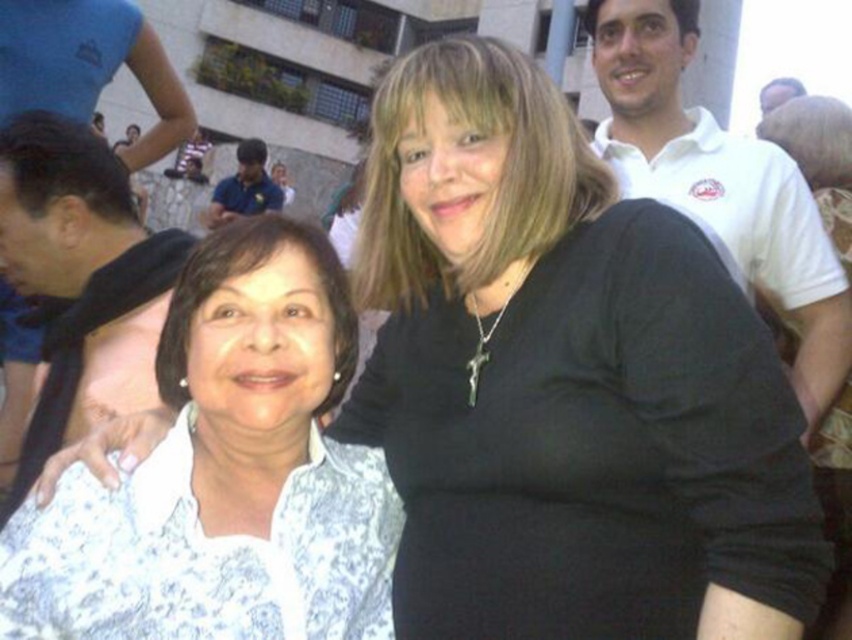
You are a photographer trying to capture a clear shot of both the black scarf at left and the blue shirt at center. Based on their positions, which one is closer to the bottom of the image?

The black scarf at left is positioned under the blue shirt at center, so it is closer to the bottom of the image.

You are a photographer trying to position two markers on a grid overlay of the image. The markers are at point (x=706, y=120) and point (x=228, y=218). Which marker is closer to the camera?

Point (x=706, y=120) is in front of point (x=228, y=218), so the marker at point (x=706, y=120) is closer to the camera.

You are a photographer trying to capture a group photo. You notice the white cotton polo shirt at upper right and the blue shirt at center in your frame. Which shirt should you adjust to ensure both are fully visible in the photo?

The white cotton polo shirt at upper right is taller than the blue shirt at center. To ensure both are fully visible, you should lower the white cotton polo shirt at upper right or raise the blue shirt at center.